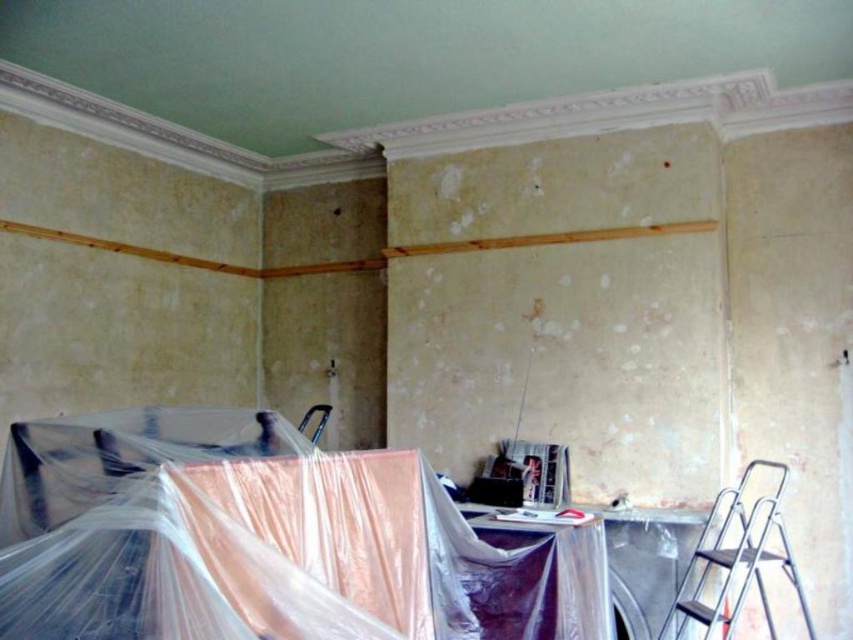
Between clear plastic at lower center and silver metallic ladder at lower right, which one is positioned higher?

Positioned higher is clear plastic at lower center.

Is point (471, 572) positioned in front of point (755, 573)?

Yes.

Identify the location of clear plastic at lower center. (264, 540).